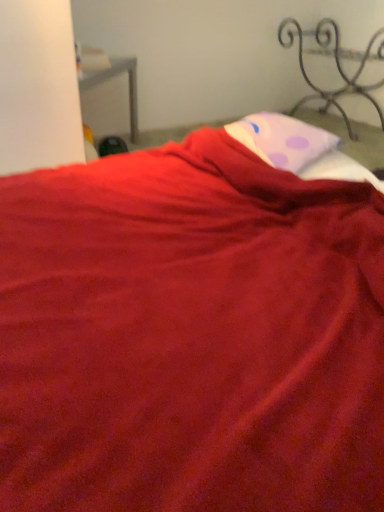
In order to face iron/textured metal bed frame at upper right, should I rotate leftwards or rightwards?

Turn right by 19.687 degrees to look at iron/textured metal bed frame at upper right.

Locate an element on the screen. The width and height of the screenshot is (384, 512). iron/textured metal bed frame at upper right is located at coordinates (336, 66).

Describe the element at coordinates (336, 66) in the screenshot. I see `iron/textured metal bed frame at upper right` at that location.

Image resolution: width=384 pixels, height=512 pixels. What do you see at coordinates (283, 140) in the screenshot?
I see `pink dotted pillow at upper center` at bounding box center [283, 140].

You are a GUI agent. You are given a task and a screenshot of the screen. Output one action in this format:
    pyautogui.click(x=<x>, y=<y>)
    Task: Click on the pink dotted pillow at upper center
    This screenshot has width=384, height=512.
    Given the screenshot: What is the action you would take?
    pyautogui.click(x=283, y=140)

This screenshot has width=384, height=512. I want to click on iron/textured metal bed frame at upper right, so click(x=336, y=66).

In the image, is iron/textured metal bed frame at upper right on the left side or the right side of pink dotted pillow at upper center?

iron/textured metal bed frame at upper right is positioned on pink dotted pillow at upper center's right side.

Which object is further away from the camera, iron/textured metal bed frame at upper right or pink dotted pillow at upper center?

iron/textured metal bed frame at upper right is further away from the camera.

Does point (369, 52) appear closer or farther from the camera than point (306, 149)?

Point (369, 52).

From the image's perspective, is iron/textured metal bed frame at upper right located beneath pink dotted pillow at upper center?

No, from the image's perspective, iron/textured metal bed frame at upper right is not below pink dotted pillow at upper center.

From a real-world perspective, is iron/textured metal bed frame at upper right physically below pink dotted pillow at upper center?

Indeed, from a real-world perspective, iron/textured metal bed frame at upper right is positioned beneath pink dotted pillow at upper center.

Can you confirm if iron/textured metal bed frame at upper right is thinner than pink dotted pillow at upper center?

In fact, iron/textured metal bed frame at upper right might be wider than pink dotted pillow at upper center.

Does iron/textured metal bed frame at upper right have a lesser height compared to pink dotted pillow at upper center?

No.

Considering the relative sizes of iron/textured metal bed frame at upper right and pink dotted pillow at upper center in the image provided, is iron/textured metal bed frame at upper right smaller than pink dotted pillow at upper center?

Incorrect, iron/textured metal bed frame at upper right is not smaller in size than pink dotted pillow at upper center.

In the scene shown: Does iron/textured metal bed frame at upper right contain pink dotted pillow at upper center?

No, iron/textured metal bed frame at upper right does not contain pink dotted pillow at upper center.

Is there a large distance between iron/textured metal bed frame at upper right and pink dotted pillow at upper center?

That's right, there is a large distance between iron/textured metal bed frame at upper right and pink dotted pillow at upper center.

Is iron/textured metal bed frame at upper right positioned with its back to pink dotted pillow at upper center?

That's not correct — iron/textured metal bed frame at upper right is not looking away from pink dotted pillow at upper center.

Image resolution: width=384 pixels, height=512 pixels. I want to click on furniture that appears above the pink dotted pillow at upper center (from the image's perspective), so click(x=336, y=66).

Does pink dotted pillow at upper center appear on the right side of iron/textured metal bed frame at upper right?

No.

Is pink dotted pillow at upper center in front of or behind iron/textured metal bed frame at upper right in the image?

Visually, pink dotted pillow at upper center is located in front of iron/textured metal bed frame at upper right.

Does point (304, 130) come in front of point (349, 85)?

Yes.

From the image's perspective, which object appears higher, pink dotted pillow at upper center or iron/textured metal bed frame at upper right?

iron/textured metal bed frame at upper right.

From a real-world perspective, is pink dotted pillow at upper center physically above iron/textured metal bed frame at upper right?

Yes, from a real-world perspective, pink dotted pillow at upper center is on top of iron/textured metal bed frame at upper right.

Considering the sizes of objects pink dotted pillow at upper center and iron/textured metal bed frame at upper right in the image provided, who is wider, pink dotted pillow at upper center or iron/textured metal bed frame at upper right?

iron/textured metal bed frame at upper right.

Who is taller, pink dotted pillow at upper center or iron/textured metal bed frame at upper right?

iron/textured metal bed frame at upper right is taller.

Based on the photo, considering the sizes of objects pink dotted pillow at upper center and iron/textured metal bed frame at upper right in the image provided, who is smaller, pink dotted pillow at upper center or iron/textured metal bed frame at upper right?

Smaller between the two is pink dotted pillow at upper center.

Would you say iron/textured metal bed frame at upper right is part of pink dotted pillow at upper center's contents?

No, iron/textured metal bed frame at upper right is not surrounded by pink dotted pillow at upper center.

Are pink dotted pillow at upper center and iron/textured metal bed frame at upper right located far from each other?

pink dotted pillow at upper center is far away from iron/textured metal bed frame at upper right.

Could you tell me if pink dotted pillow at upper center is turned towards iron/textured metal bed frame at upper right?

No, pink dotted pillow at upper center does not turn towards iron/textured metal bed frame at upper right.

Could you measure the distance between pink dotted pillow at upper center and iron/textured metal bed frame at upper right?

pink dotted pillow at upper center is 5.71 feet from iron/textured metal bed frame at upper right.

I want to click on pillow that appears below the iron/textured metal bed frame at upper right (from the image's perspective), so [x=283, y=140].

Image resolution: width=384 pixels, height=512 pixels. Identify the location of pillow below the iron/textured metal bed frame at upper right (from the image's perspective). (283, 140).

The height and width of the screenshot is (512, 384). I want to click on furniture above the pink dotted pillow at upper center (from the image's perspective), so pyautogui.click(x=336, y=66).